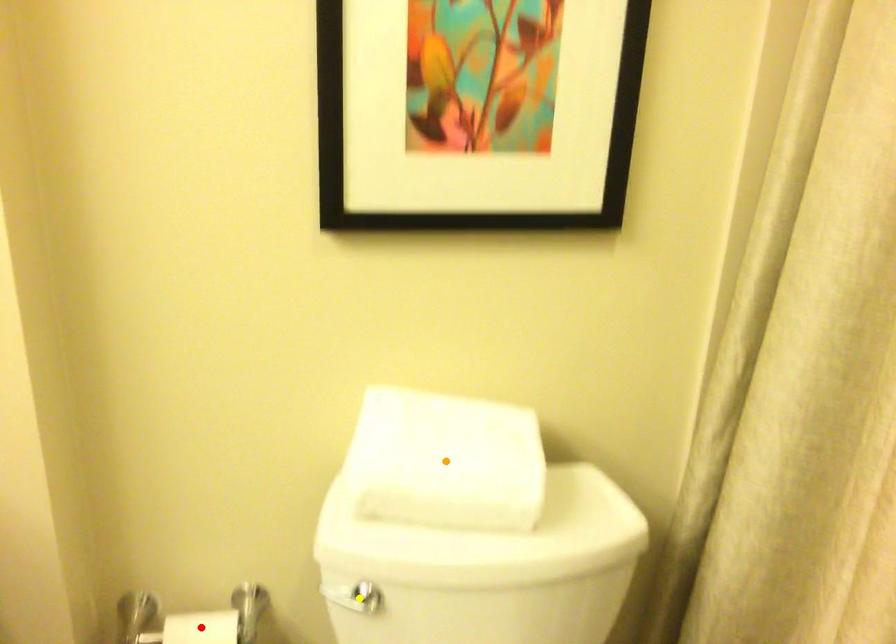
Order these from nearest to farthest:
A) orange point
B) yellow point
C) red point

orange point < yellow point < red point